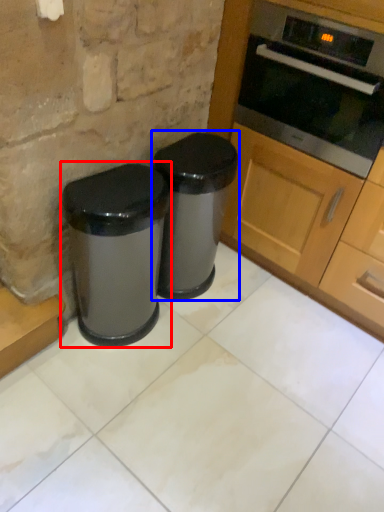
Question: Which object is further to the camera taking this photo, waste container (highlighted by a red box) or waste container (highlighted by a blue box)?

Choices:
 (A) waste container
 (B) waste container

Answer: (B)